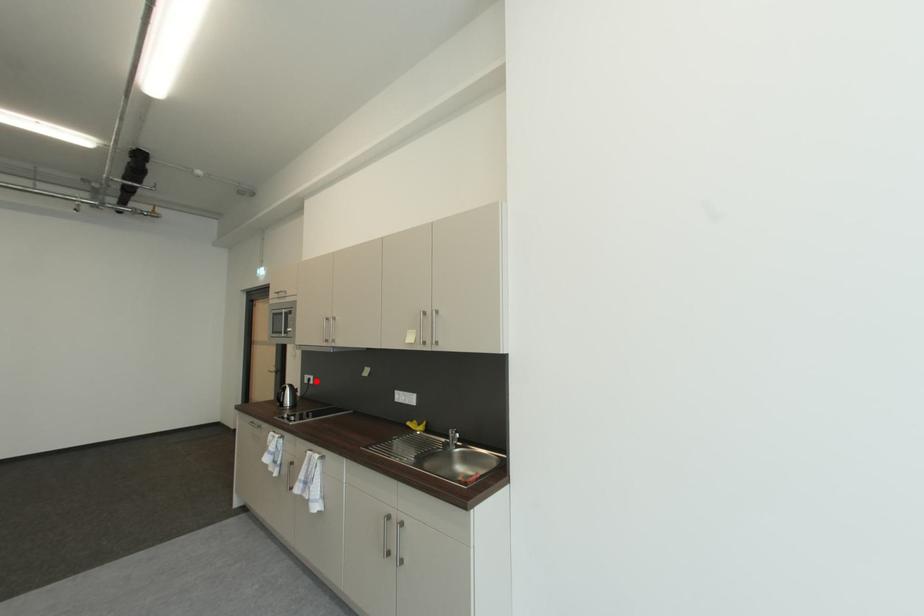
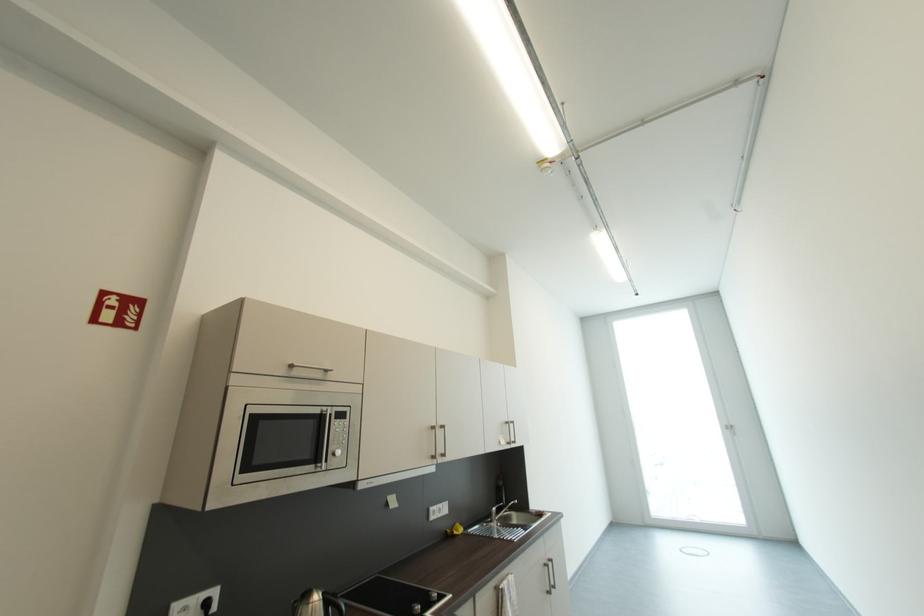
Find the pixel in the second image that matches the highlighted location in the first image.

(213, 605)